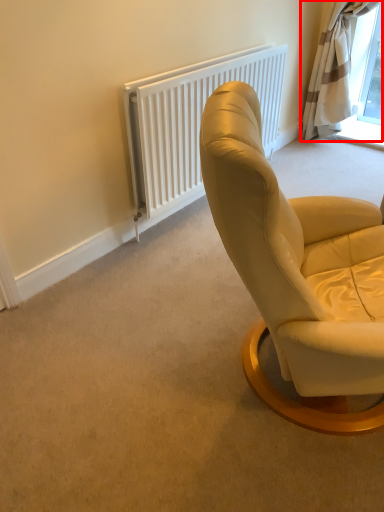
Question: From the image's perspective, what is the correct spatial relationship of curtain (annotated by the red box) in relation to radiator?

Choices:
 (A) above
 (B) below

Answer: (A)